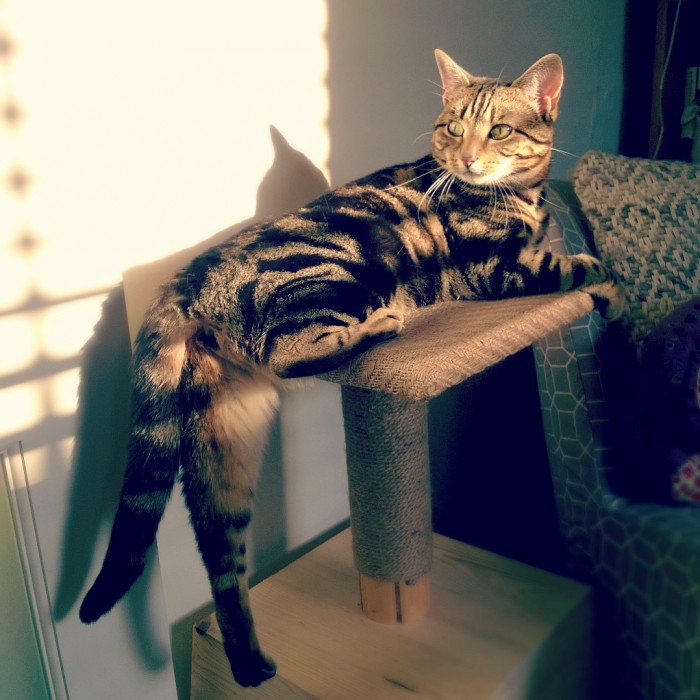
At what (x,y) coordinates should I click in order to perform the action: click on right front leg. Please return your answer as a coordinate pair (x, y). Looking at the image, I should click on (549, 276).